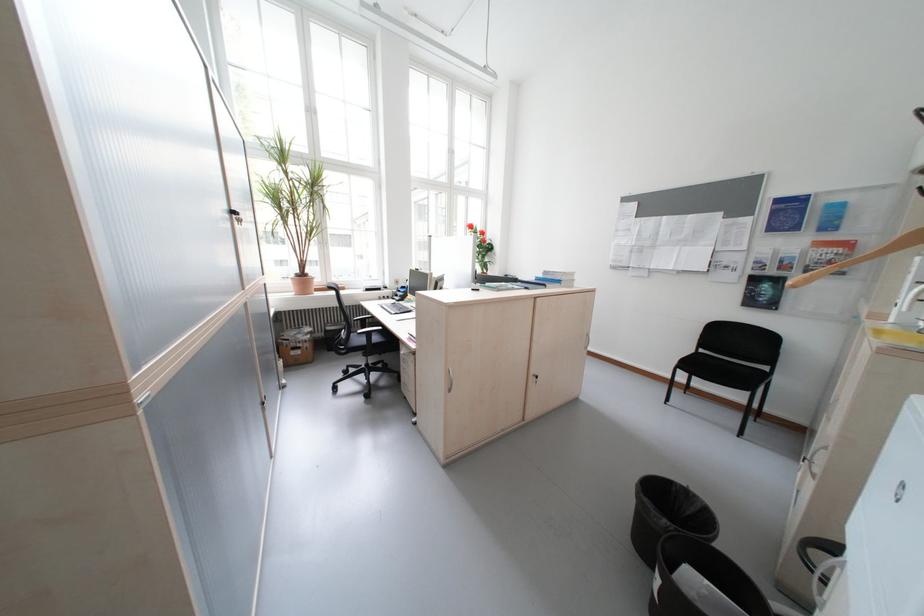
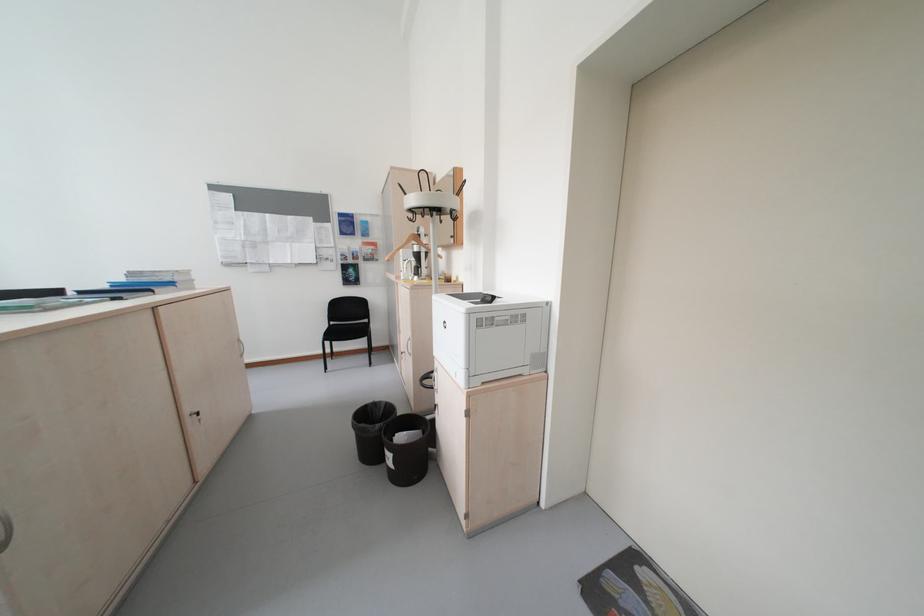
Where in the second image is the point corresponding to pixel 560 278 from the first image?

(155, 281)